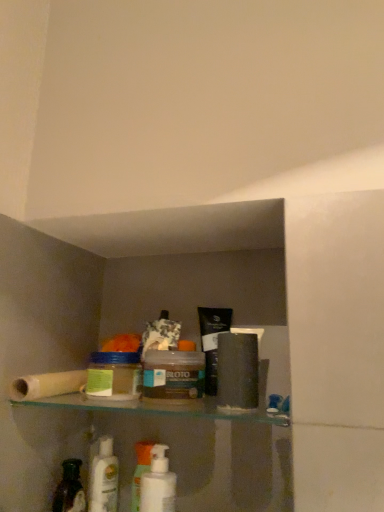
Question: Looking at the image, does translucent plastic jar at center, acting as the second product starting from the right, seem bigger or smaller compared to matte brown jar at center, the 2th product from the left?

Choices:
 (A) big
 (B) small

Answer: (B)

Question: Is translucent plastic jar at center, acting as the second product starting from the right, wider or thinner than matte brown jar at center, the 2th product from the left?

Choices:
 (A) wide
 (B) thin

Answer: (B)

Question: Which is farther from the white plastic mouthwash at center, positioned as the 1th mouthwash in right-to-left order?

Choices:
 (A) matte brown jar at center, which is the first product in right-to-left order
 (B) translucent plastic bottle at lower left
 (C) translucent plastic jar at center, the first product viewed from the left
 (D) white glossy mouthwash at lower left, which is the 2th mouthwash from right to left
 (E) white plastic pump bottle at lower center

Answer: (A)

Question: Estimate the real-world distances between objects in this image. Which object is farther from the translucent plastic jar at center, the first product viewed from the left?

Choices:
 (A) white plastic mouthwash at center, positioned as the 1th mouthwash in right-to-left order
 (B) white glossy mouthwash at lower left, which is counted as the first mouthwash, starting from the back
 (C) white plastic pump bottle at lower center
 (D) matte brown jar at center, the 2th product from the left
 (E) translucent plastic roll at left

Answer: (B)